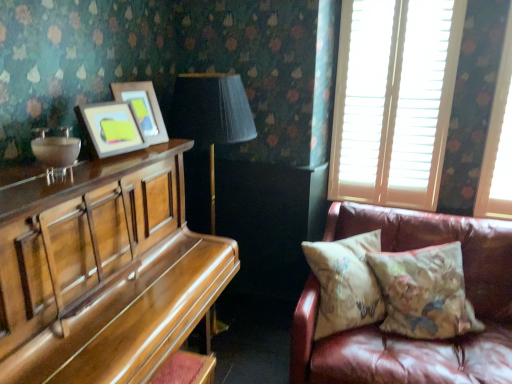
Where is `free spot to the right of matte wooden picture frame at upper left, which is the 2th picture frame from back to front`? free spot to the right of matte wooden picture frame at upper left, which is the 2th picture frame from back to front is located at coordinates (145, 156).